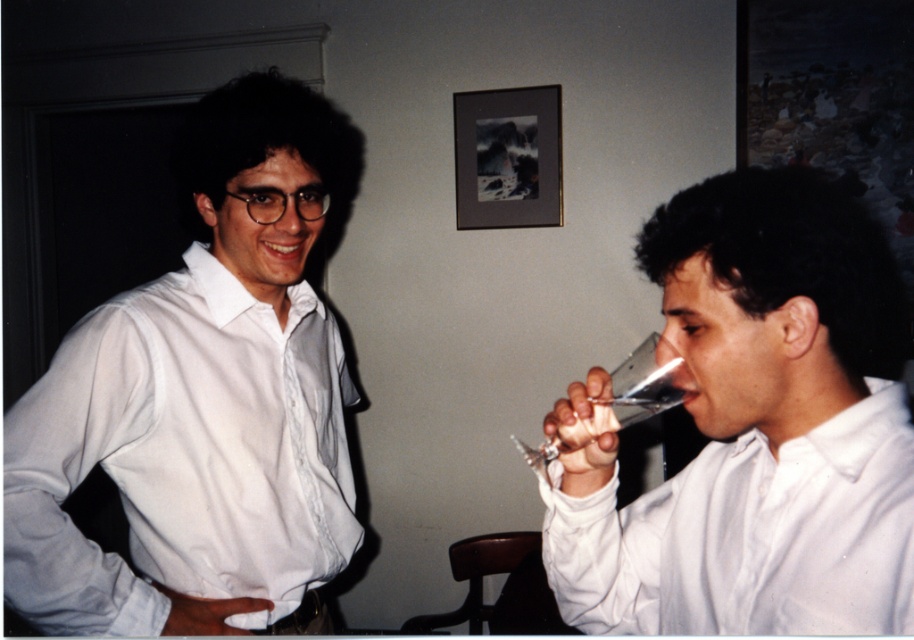
You are standing at the origin point in the image. There are two points marked in the image, one at coordinates point (331, 106) and another at point (756, 474). Which of these points is closer to you?

Point (331, 106) is behind point (756, 474), so the point closer to you is point (756, 474).

You are a photographer trying to capture a candid shot of both the white glossy shirt at left and the clear glass wine glass at right. If you want to ensure both are in focus, which object should you prioritize focusing on first?

The white glossy shirt at left should be prioritized for focus since it is wider than the clear glass wine glass at right, ensuring it remains sharp while the glass may still be in the depth of field.

You are a photographer trying to capture a closeup shot of both the white glossy shirt at left and the clear glass wine glass at right. Since you want to focus on both equally, which object should you adjust your camera settings to prioritize in terms of size to ensure both fit in the frame?

The white glossy shirt at left is larger in size than the clear glass wine glass at right. To ensure both fit in the frame, you should prioritize adjusting the camera settings to accommodate the larger size of the white glossy shirt at left.